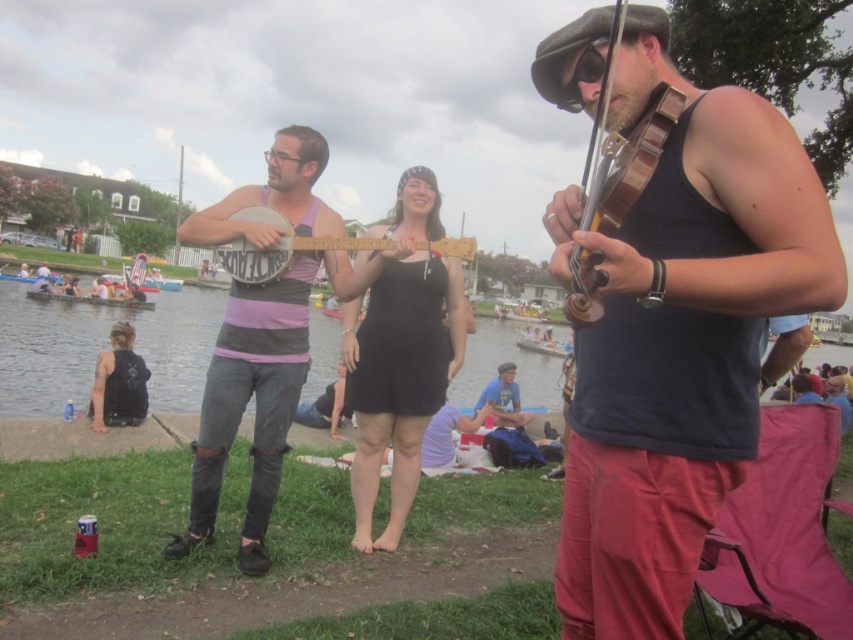
You are organizing a small performance on a narrow stage that can only accommodate items wider than 1 meter. You have the black fabric dress at center and the wooden violin at right. Which item should you prioritize placing on the stage first to ensure both fit?

The black fabric dress at center should be placed first because its width is larger than the wooden violin at right, ensuring there is enough space for both items on the narrow stage.

You are a photographer trying to capture a clear shot of both the black fabric dress at center and the wooden banjo at center. Since the dress is larger than the banjo, which object should you focus on first to ensure it fits properly in the frame?

The black fabric dress at center has a larger size compared to the wooden banjo at center, so you should focus on positioning the dress first to ensure it fits within the frame, then adjust for the smaller banjo.